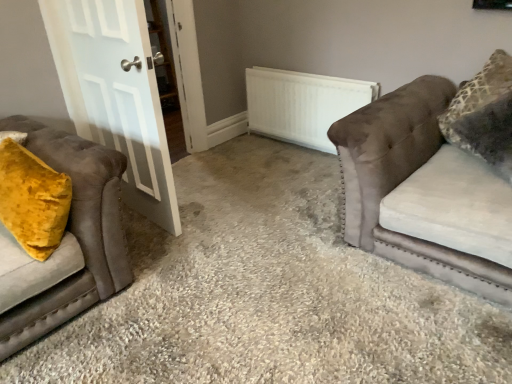
Question: From a real-world perspective, is white matte radiator at center on velvet brown couch at right, placed as the first studio couch when sorted from right to left?

Choices:
 (A) yes
 (B) no

Answer: (B)

Question: From the image's perspective, is white matte radiator at center on top of velvet brown couch at right, placed as the first studio couch when sorted from right to left?

Choices:
 (A) no
 (B) yes

Answer: (B)

Question: Is white matte radiator at center to the right of velvet brown couch at right, placed as the first studio couch when sorted from right to left, from the viewer's perspective?

Choices:
 (A) no
 (B) yes

Answer: (A)

Question: Is white matte radiator at center shorter than velvet brown couch at right, placed as the first studio couch when sorted from right to left?

Choices:
 (A) yes
 (B) no

Answer: (A)

Question: Can you confirm if white matte radiator at center is smaller than velvet brown couch at right, positioned as the second studio couch in left-to-right order?

Choices:
 (A) no
 (B) yes

Answer: (B)

Question: Considering the positions of white glossy door at left and velvet mustard pillow at left, the 2th studio couch from the right, in the image, is white glossy door at left taller or shorter than velvet mustard pillow at left, the 2th studio couch from the right,?

Choices:
 (A) short
 (B) tall

Answer: (B)

Question: Is white glossy door at left bigger or smaller than velvet mustard pillow at left, marked as the 1th studio couch in a left-to-right arrangement?

Choices:
 (A) small
 (B) big

Answer: (A)

Question: Considering their positions, is white glossy door at left located in front of or behind velvet mustard pillow at left, the 2th studio couch from the right?

Choices:
 (A) front
 (B) behind

Answer: (B)

Question: Is point (92, 94) positioned closer to the camera than point (89, 271)?

Choices:
 (A) farther
 (B) closer

Answer: (A)

Question: Considering the positions of velvet mustard pillow at left, the 2th studio couch from the right, and velvet brown couch at right, positioned as the second studio couch in left-to-right order, in the image, is velvet mustard pillow at left, the 2th studio couch from the right, wider or thinner than velvet brown couch at right, positioned as the second studio couch in left-to-right order,?

Choices:
 (A) wide
 (B) thin

Answer: (B)

Question: Is velvet mustard pillow at left, marked as the 1th studio couch in a left-to-right arrangement, in front of or behind velvet brown couch at right, positioned as the second studio couch in left-to-right order, in the image?

Choices:
 (A) behind
 (B) front

Answer: (B)

Question: Based on their positions, is velvet mustard pillow at left, the 2th studio couch from the right, located to the left or right of velvet brown couch at right, positioned as the second studio couch in left-to-right order?

Choices:
 (A) right
 (B) left

Answer: (B)

Question: From the image's perspective, is velvet mustard pillow at left, the 2th studio couch from the right, above or below velvet brown couch at right, positioned as the second studio couch in left-to-right order?

Choices:
 (A) below
 (B) above

Answer: (A)

Question: Looking at the image, does velvet brown couch at right, placed as the first studio couch when sorted from right to left, seem bigger or smaller compared to velvet mustard pillow at left, the 2th studio couch from the right?

Choices:
 (A) small
 (B) big

Answer: (B)

Question: Is point (444, 231) positioned closer to the camera than point (79, 210)?

Choices:
 (A) closer
 (B) farther

Answer: (B)